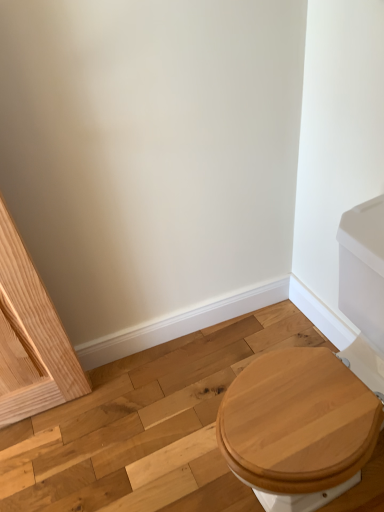
You are a GUI agent. You are given a task and a screenshot of the screen. Output one action in this format:
    pyautogui.click(x=<x>, y=<y>)
    Task: Click on the vacant area on top of natural wood stairwell at lower right (from a real-world perspective)
    This screenshot has height=512, width=384.
    Given the screenshot: What is the action you would take?
    pyautogui.click(x=152, y=429)